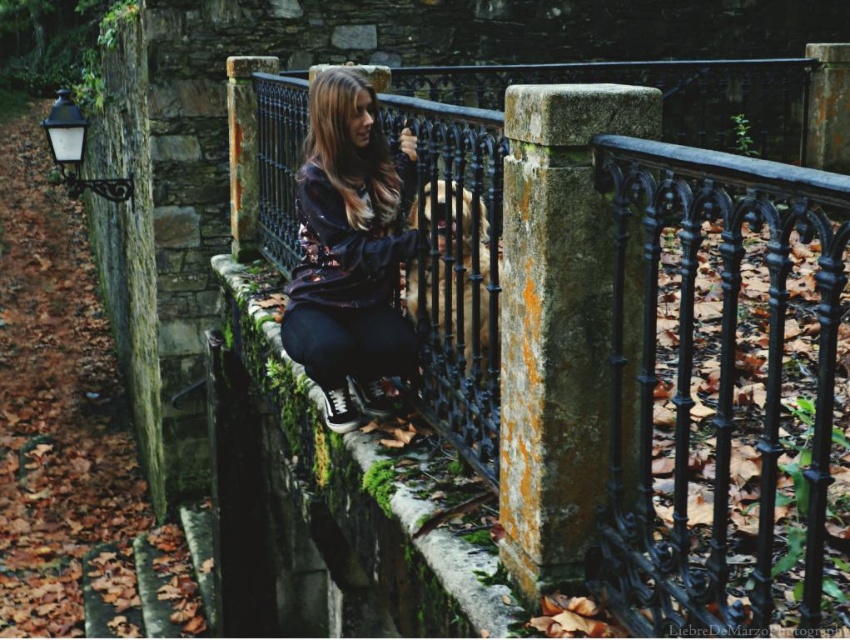
Question: Does shiny black hoodie at center have a lesser width compared to mossy stone ledge at center?

Choices:
 (A) yes
 (B) no

Answer: (B)

Question: Which of the following is the closest to the observer?

Choices:
 (A) (468, 616)
 (B) (745, 440)

Answer: (A)

Question: Is the position of black wrought iron fence at center less distant than that of mossy stone ledge at center?

Choices:
 (A) no
 (B) yes

Answer: (B)

Question: Which of the following is the closest to the observer?

Choices:
 (A) shiny black hoodie at center
 (B) black wrought iron railing at center right
 (C) black wrought iron fence at center

Answer: (B)

Question: Which of the following is the closest to the observer?

Choices:
 (A) [244, 276]
 (B) [751, 304]

Answer: (B)

Question: Is shiny black hoodie at center behind mossy stone ledge at center?

Choices:
 (A) no
 (B) yes

Answer: (B)